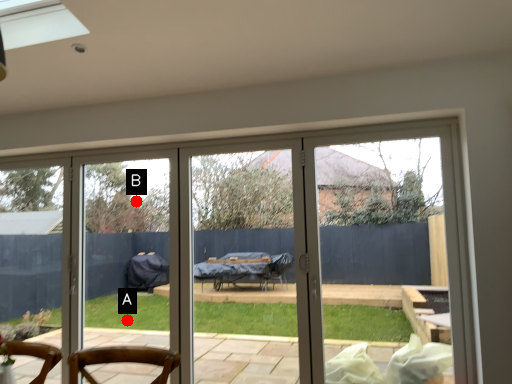
Question: Two points are circled on the image, labeled by A and B beside each circle. Which point is closer to the camera?

Choices:
 (A) A is closer
 (B) B is closer

Answer: (A)